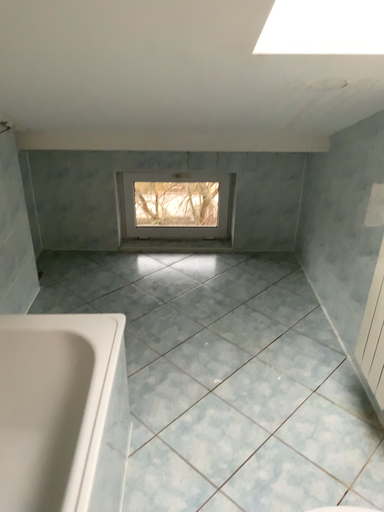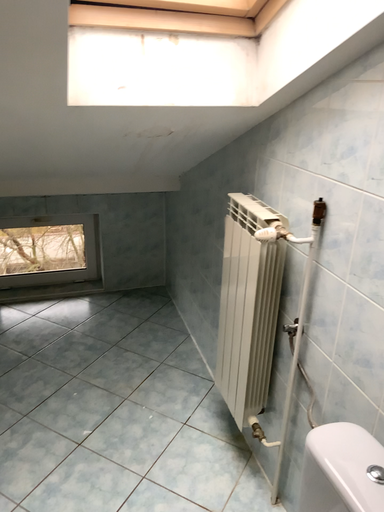
Question: Which way did the camera rotate in the video?

Choices:
 (A) rotated left
 (B) rotated right

Answer: (B)